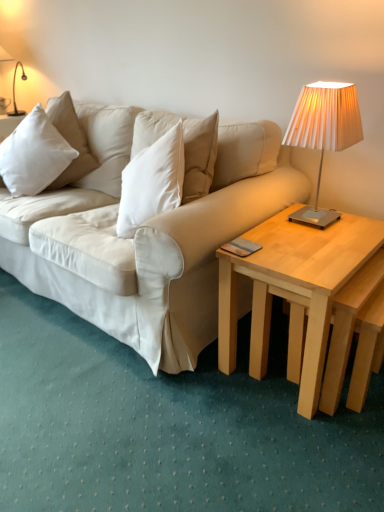
At what (x,y) coordinates should I click in order to perform the action: click on free region on the left part of metallic pleated lampshade at upper right. Please return your answer as a coordinate pair (x, y). This screenshot has height=512, width=384. Looking at the image, I should click on (277, 227).